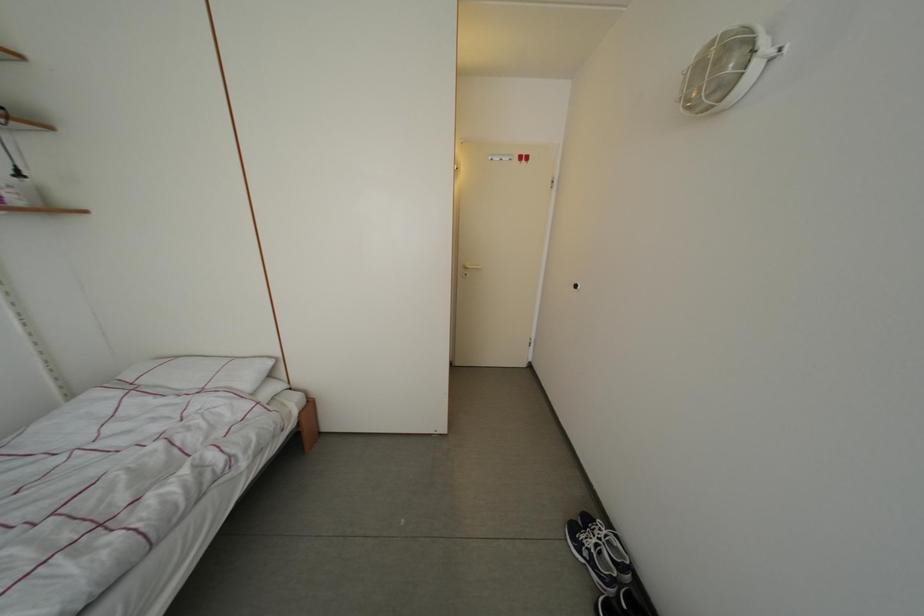
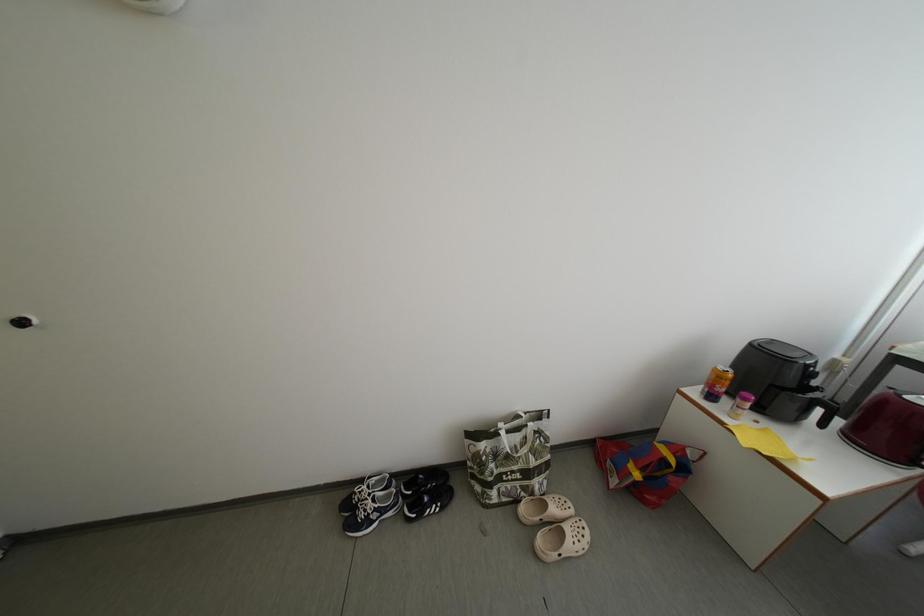
First-person continuous shooting, in which direction is the camera rotating?

The camera rotated toward right-down.